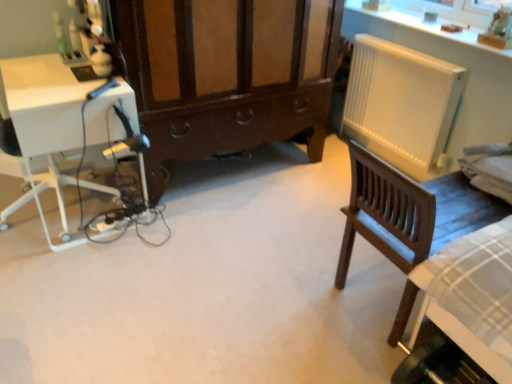
Describe the element at coordinates (401, 104) in the screenshot. I see `white plastic radiator at right` at that location.

Identify the location of dark wood chair at right. (409, 212).

You are a GUI agent. You are given a task and a screenshot of the screen. Output one action in this format:
    pyautogui.click(x=<x>, y=<y>)
    Task: Click on the white plastic radiator at right
    
    Given the screenshot: What is the action you would take?
    pyautogui.click(x=401, y=104)

Is point (429, 172) behind point (366, 207)?

Yes, it is.

Is dark wood chair at right surrounded by white plastic radiator at right?

No, white plastic radiator at right does not contain dark wood chair at right.

Can you confirm if white plastic radiator at right is positioned to the left of dark wood chair at right?

Indeed, white plastic radiator at right is positioned on the left side of dark wood chair at right.

From the image's perspective, is white plastic radiator at right below dark wood chair at right?

Actually, white plastic radiator at right appears above dark wood chair at right in the image.

Could you tell me if white plastic computer desk at left is facing dark wood chair at right?

No, white plastic computer desk at left is not turned towards dark wood chair at right.

Where is `chair that appears below the white plastic computer desk at left (from the image's perspective)`? chair that appears below the white plastic computer desk at left (from the image's perspective) is located at coordinates (409, 212).

Is white plastic computer desk at left completely or partially outside of dark wood chair at right?

That's correct, white plastic computer desk at left is outside of dark wood chair at right.

From a real-world perspective, is white plastic computer desk at left on top of dark wood chair at right?

Incorrect, from a real-world perspective, white plastic computer desk at left is lower than dark wood chair at right.

Which of these two, brown wood cabinet at center or white plastic computer desk at left, stands taller?

brown wood cabinet at center.

Identify the location of cabinetry located behind the white plastic computer desk at left. The width and height of the screenshot is (512, 384). (227, 74).

Is brown wood cabinet at center bigger than white plastic computer desk at left?

Correct, brown wood cabinet at center is larger in size than white plastic computer desk at left.

From the image's perspective, which is above, brown wood cabinet at center or white plastic radiator at right?

brown wood cabinet at center is shown above in the image.

Who is shorter, brown wood cabinet at center or white plastic radiator at right?

With less height is white plastic radiator at right.

Based on their sizes in the image, would you say brown wood cabinet at center is bigger or smaller than white plastic radiator at right?

Clearly, brown wood cabinet at center is larger in size than white plastic radiator at right.

Considering their positions, is white plastic computer desk at left located in front of or behind white plastic radiator at right?

white plastic computer desk at left is positioned closer to the viewer than white plastic radiator at right.

Considering the sizes of objects white plastic computer desk at left and white plastic radiator at right in the image provided, who is thinner, white plastic computer desk at left or white plastic radiator at right?

With smaller width is white plastic radiator at right.

Considering the points (130, 122) and (428, 167), which point is in front, point (130, 122) or point (428, 167)?

The point (130, 122) is closer.

Which of these two, dark wood chair at right or brown wood cabinet at center, stands taller?

With more height is brown wood cabinet at center.

Does dark wood chair at right appear on the right side of brown wood cabinet at center?

Yes.

From the image's perspective, is dark wood chair at right over brown wood cabinet at center?

Incorrect, from the image's perspective, dark wood chair at right is lower than brown wood cabinet at center.

The width and height of the screenshot is (512, 384). I want to click on cabinetry behind the dark wood chair at right, so click(x=227, y=74).

Is white plastic computer desk at left completely or partially outside of brown wood cabinet at center?

Yes, white plastic computer desk at left is not within brown wood cabinet at center.

Consider the image. Is white plastic computer desk at left facing towards brown wood cabinet at center?

No, white plastic computer desk at left is not facing towards brown wood cabinet at center.

Which is more to the right, white plastic computer desk at left or brown wood cabinet at center?

brown wood cabinet at center.

This screenshot has width=512, height=384. I want to click on chair in front of the white plastic radiator at right, so point(409,212).

The height and width of the screenshot is (384, 512). Identify the location of computer desk behind the dark wood chair at right. (61, 126).

Considering their positions, is white plastic radiator at right positioned further to white plastic computer desk at left than brown wood cabinet at center?

white plastic radiator at right is positioned further to the anchor white plastic computer desk at left.

Looking at this image, when comparing their distances from white plastic computer desk at left, does brown wood cabinet at center or white plastic radiator at right seem further?

white plastic radiator at right lies further to white plastic computer desk at left than the other object.

Based on their spatial positions, is dark wood chair at right or brown wood cabinet at center further from white plastic computer desk at left?

dark wood chair at right is further to white plastic computer desk at left.

From the image, which object appears to be nearer to white plastic computer desk at left, white plastic radiator at right or dark wood chair at right?

dark wood chair at right is positioned closer to the anchor white plastic computer desk at left.

When comparing their distances from white plastic radiator at right, does white plastic computer desk at left or dark wood chair at right seem further?

white plastic computer desk at left.

When comparing their distances from dark wood chair at right, does white plastic computer desk at left or white plastic radiator at right seem closer?

white plastic radiator at right lies closer to dark wood chair at right than the other object.

Estimate the real-world distances between objects in this image. Which object is closer to dark wood chair at right, brown wood cabinet at center or white plastic computer desk at left?

brown wood cabinet at center.

From the image, which object appears to be farther from white plastic radiator at right, brown wood cabinet at center or dark wood chair at right?

dark wood chair at right is positioned further to the anchor white plastic radiator at right.

Locate an element on the screen. This screenshot has width=512, height=384. radiator situated between white plastic computer desk at left and dark wood chair at right from left to right is located at coordinates (401, 104).

Image resolution: width=512 pixels, height=384 pixels. What are the coordinates of `radiator between brown wood cabinet at center and dark wood chair at right in the horizontal direction` in the screenshot? It's located at (401, 104).

Where is `cabinetry between white plastic computer desk at left and white plastic radiator at right from left to right`? cabinetry between white plastic computer desk at left and white plastic radiator at right from left to right is located at coordinates (227, 74).

Locate an element on the screen. This screenshot has height=384, width=512. cabinetry situated between white plastic computer desk at left and dark wood chair at right from left to right is located at coordinates (227, 74).